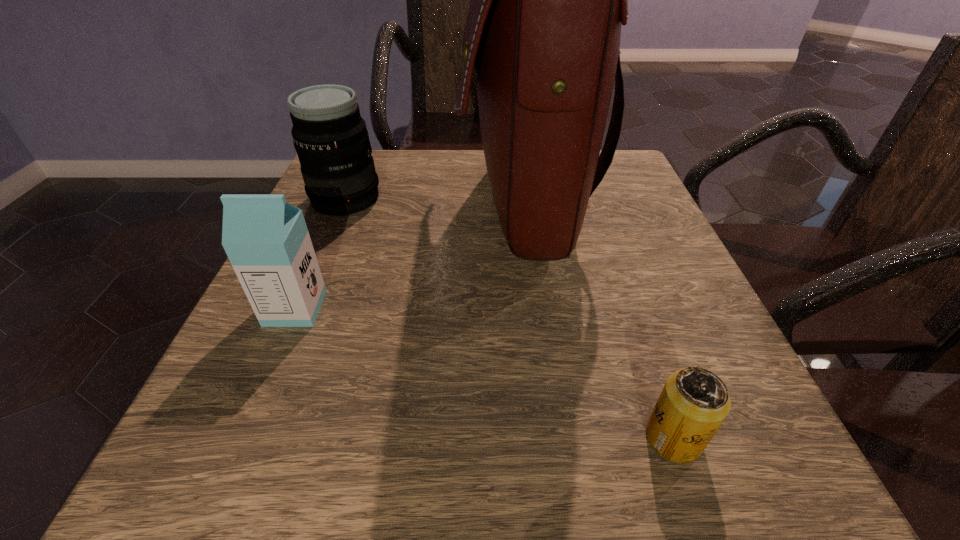
Locate an element on the screen. This screenshot has width=960, height=540. vacant area that lies between the milk carton and the nearest object is located at coordinates (485, 373).

Find the location of `vacant space in between the nearest object and the telephoto lens`. vacant space in between the nearest object and the telephoto lens is located at coordinates (510, 319).

Identify the location of free spot between the tallest object and the milk carton. Image resolution: width=960 pixels, height=540 pixels. (409, 257).

Where is `empty space between the satchel and the telephoto lens`? empty space between the satchel and the telephoto lens is located at coordinates (434, 202).

Where is `vacant area between the milk carton and the tallest object`? The height and width of the screenshot is (540, 960). vacant area between the milk carton and the tallest object is located at coordinates (409, 257).

This screenshot has width=960, height=540. I want to click on free spot between the tallest object and the telephoto lens, so click(x=434, y=202).

At what (x,y) coordinates should I click in order to perform the action: click on object that ranks as the third closest to the nearest object. Please return your answer as a coordinate pair (x, y). The height and width of the screenshot is (540, 960). Looking at the image, I should click on (330, 137).

In order to click on the third closest object to the beer can in this screenshot , I will do `click(330, 137)`.

Find the location of `vacant space that satisfies the following two spatial constraints: 1. on the front side of the nearest object; 2. on the right side of the telephoto lens`. vacant space that satisfies the following two spatial constraints: 1. on the front side of the nearest object; 2. on the right side of the telephoto lens is located at coordinates (246, 438).